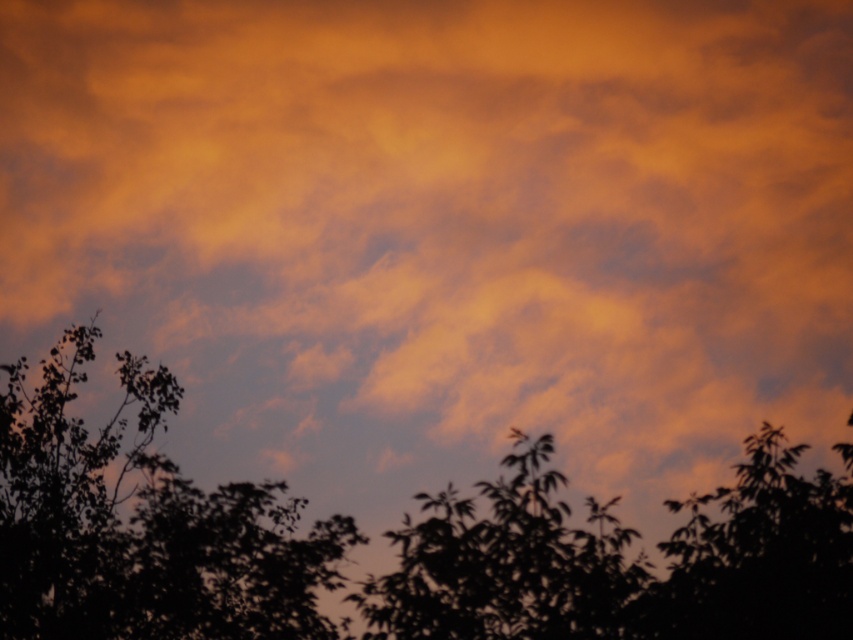
Measure the distance between silhouette leafy tree at lower center and camera.

silhouette leafy tree at lower center is 10.36 meters from camera.

Is silhouette leafy tree at lower center bigger than silhouette leafy tree at center?

Yes, silhouette leafy tree at lower center is bigger than silhouette leafy tree at center.

Is point (579, 612) positioned behind point (503, 528)?

No, it is in front of (503, 528).

I want to click on silhouette leafy tree at lower center, so click(x=624, y=560).

Can you confirm if silhouette leafy tree at lower center is thinner than silhouette leafy tree at lower left?

Incorrect, silhouette leafy tree at lower center's width is not less than silhouette leafy tree at lower left's.

Does silhouette leafy tree at lower center appear over silhouette leafy tree at lower left?

No.

Does point (77, 572) come farther from viewer compared to point (12, 371)?

No, (77, 572) is in front of (12, 371).

At what (x,y) coordinates should I click in order to perform the action: click on silhouette leafy tree at lower center. Please return your answer as a coordinate pair (x, y). Looking at the image, I should click on (624, 560).

Which is more to the left, silhouette leafy tree at lower center or silhouette leafy tree at lower right?

Positioned to the left is silhouette leafy tree at lower center.

Can you confirm if silhouette leafy tree at lower center is shorter than silhouette leafy tree at lower right?

Incorrect, silhouette leafy tree at lower center's height does not fall short of silhouette leafy tree at lower right's.

Is point (846, 465) positioned in front of point (814, 552)?

No, (846, 465) is behind (814, 552).

Identify the location of silhouette leafy tree at lower center. The image size is (853, 640). (624, 560).